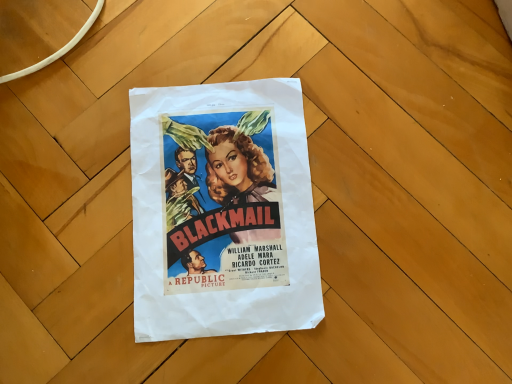
You are a GUI agent. You are given a task and a screenshot of the screen. Output one action in this format:
    pyautogui.click(x=<x>, y=<y>)
    Task: Click on the free space above matte paper poster at center (from a real-world perspective)
    The width and height of the screenshot is (512, 384).
    Given the screenshot: What is the action you would take?
    pyautogui.click(x=216, y=204)